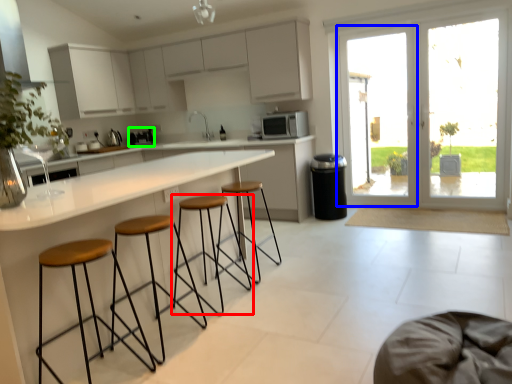
Question: Considering the real-world distances, which object is farthest from stool (highlighted by a red box)? screen door (highlighted by a blue box) or coffee machine (highlighted by a green box)?

Choices:
 (A) screen door
 (B) coffee machine

Answer: (A)